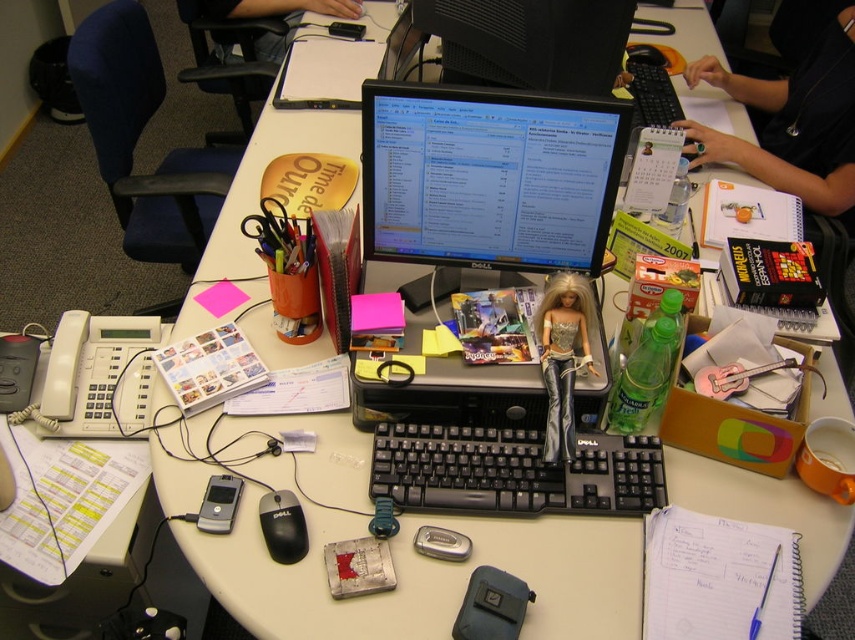
Question: Does black fabric shirt at upper right have a lesser width compared to black glossy monitor at upper center?

Choices:
 (A) no
 (B) yes

Answer: (A)

Question: Which point appears closest to the camera in this image?

Choices:
 (A) (429, 531)
 (B) (499, 600)

Answer: (B)

Question: Does black fabric pouch at center appear over silver metallic cell phone at center?

Choices:
 (A) no
 (B) yes

Answer: (A)

Question: Which object is the closest to the brushed metal usb drive at center?

Choices:
 (A) black fabric shirt at upper right
 (B) metallic silver badge at center
 (C) black plastic keyboard at center

Answer: (B)

Question: Which object appears farthest from the camera in this image?

Choices:
 (A) black fabric shirt at upper right
 (B) metallic silver badge at center

Answer: (A)

Question: Can you confirm if black glossy monitor at upper center is positioned to the left of silver metallic cell phone at center?

Choices:
 (A) yes
 (B) no

Answer: (B)